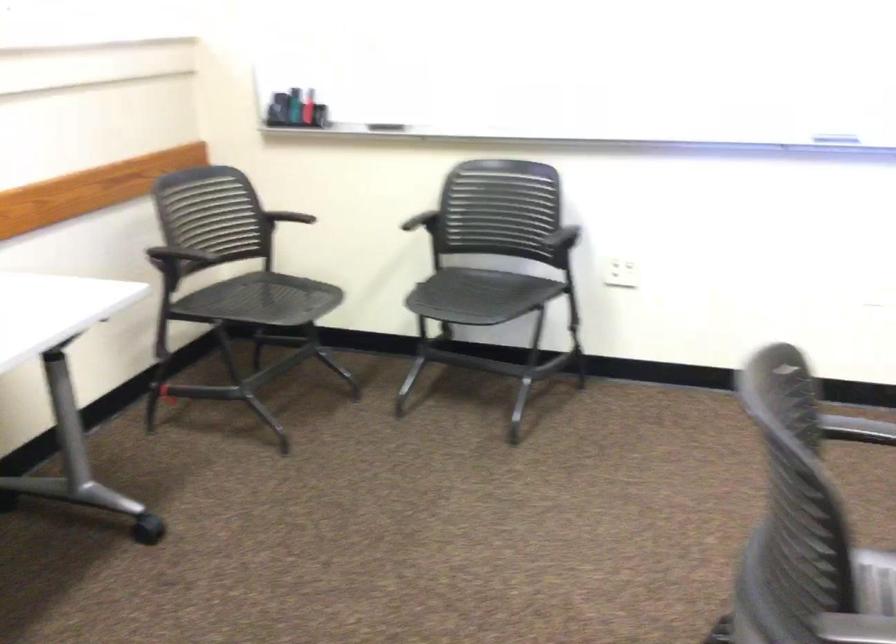
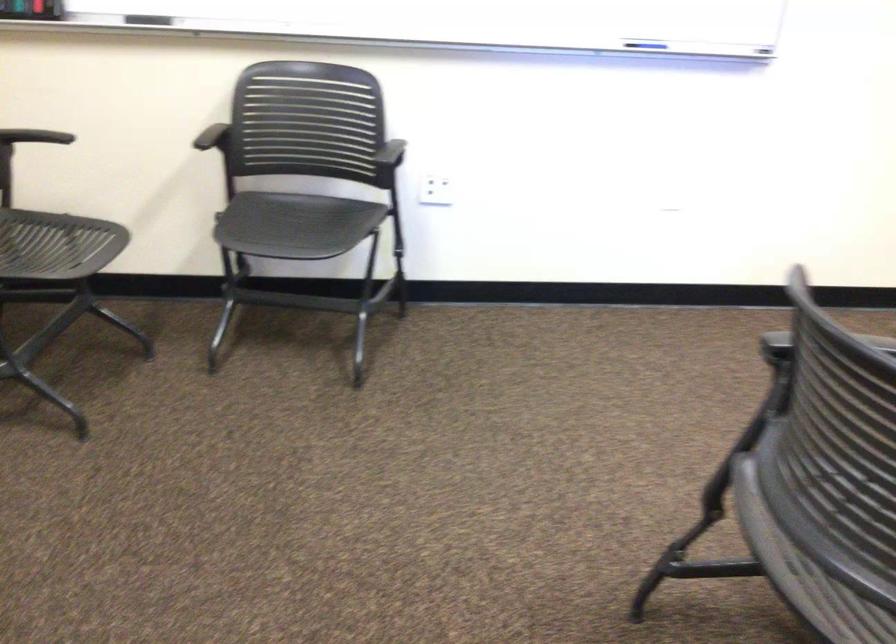
The point at [380,127] is marked in the first image. Where is the corresponding point in the second image?

(148, 20)